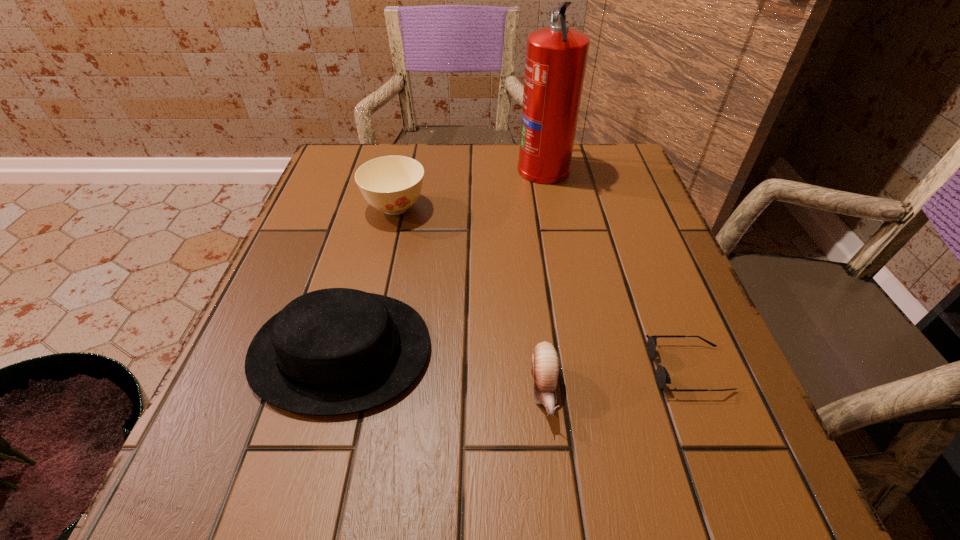
This screenshot has height=540, width=960. I want to click on free space that satisfies the following two spatial constraints: 1. on the front-facing side of the sunglasses; 2. on the front-facing side of the escargot, so click(696, 389).

Find the location of a particular element. This screenshot has width=960, height=540. free space in the image that satisfies the following two spatial constraints: 1. on the front-facing side of the shortest object; 2. on the front-facing side of the escargot is located at coordinates (696, 389).

This screenshot has height=540, width=960. What are the coordinates of `free spot that satisfies the following two spatial constraints: 1. on the front-facing side of the rightmost object; 2. on the front-facing side of the second shortest object` in the screenshot? It's located at point(696,389).

Locate an element on the screen. The image size is (960, 540). free location that satisfies the following two spatial constraints: 1. on the front-facing side of the shortest object; 2. on the front-facing side of the escargot is located at coordinates (696, 389).